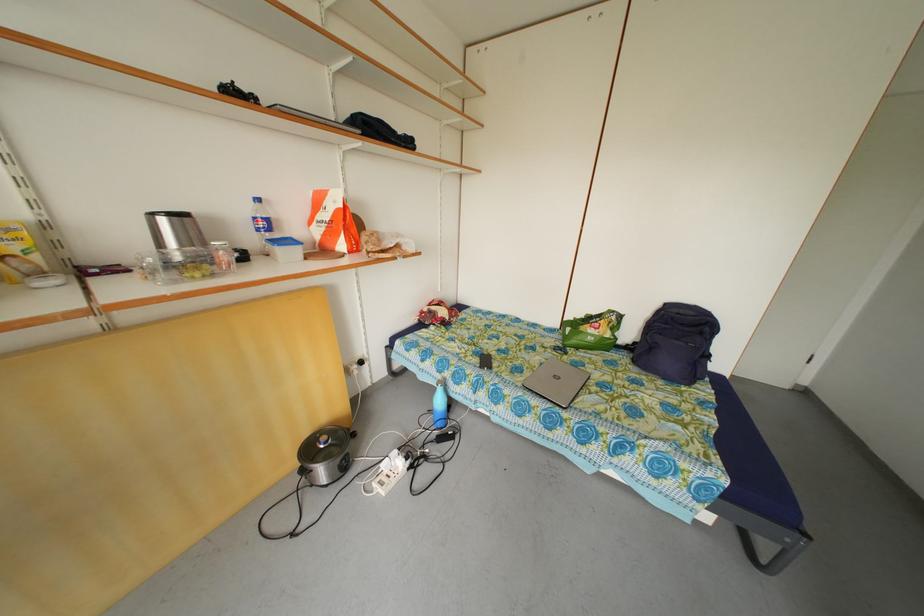
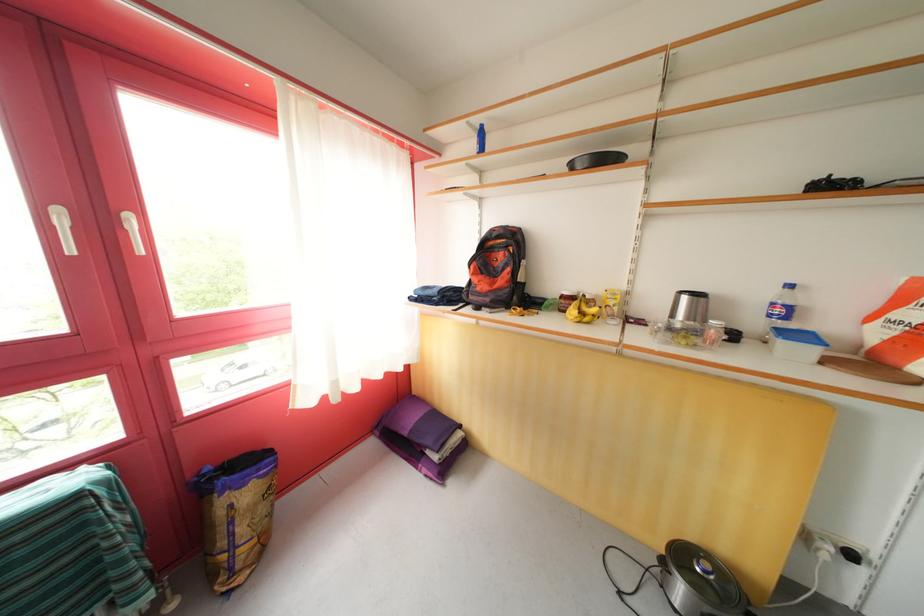
Question: How did the camera likely rotate?

Choices:
 (A) Left
 (B) Right
 (C) Up
 (D) Down

Answer: (A)